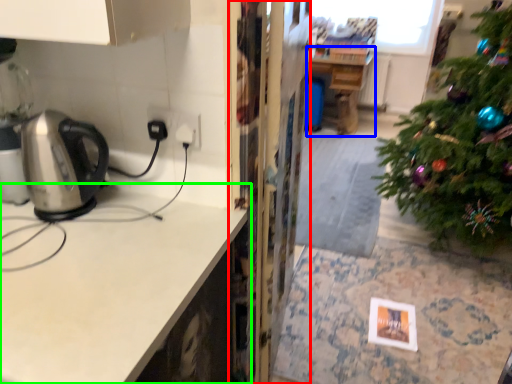
Question: Which is farther away from screen door (highlighted by a red box)? table (highlighted by a blue box) or countertop (highlighted by a green box)?

Choices:
 (A) table
 (B) countertop

Answer: (A)